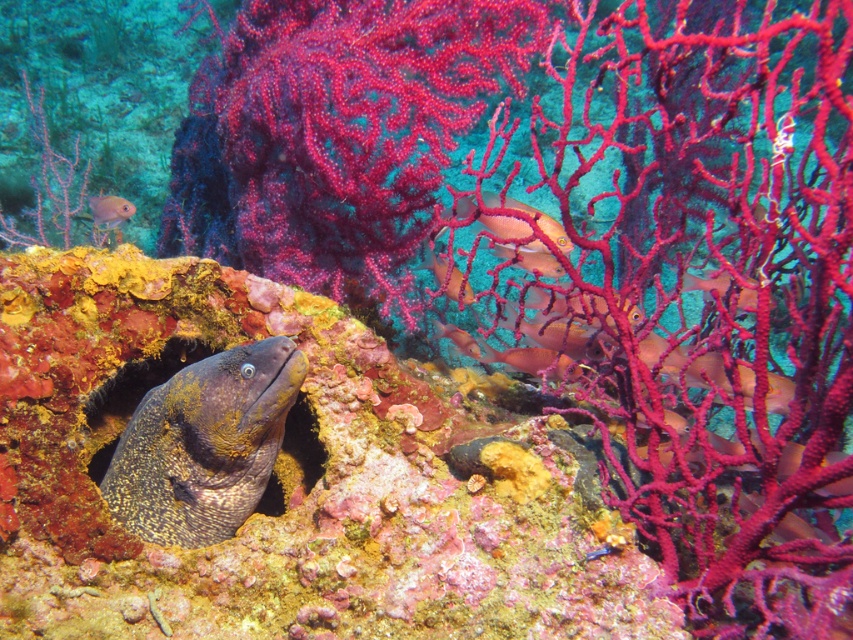
You are an underwater photographer aiming to capture both the orange matte fish at center and the smooth orange fish at center in a single frame. Based on their sizes, which fish would require you to move closer to fill the frame adequately?

The orange matte fish at center has a lesser width compared to the smooth orange fish at center, so you would need to move closer to the orange matte fish at center to adequately fill the frame.

You are a marine biologist observing this underwater scene. You notice an orange matte fish at upper right and a vivid pink coral at center. Which object has a greater height in this image?

The orange matte fish at upper right is taller than the vivid pink coral at center according to the description.

You are a scuba diver observing the underwater scene. You notice an orange matte fish at upper right and a vivid pink coral at center. Which object is nearer to you?

The orange matte fish at upper right is closer to the viewer than the vivid pink coral at center.